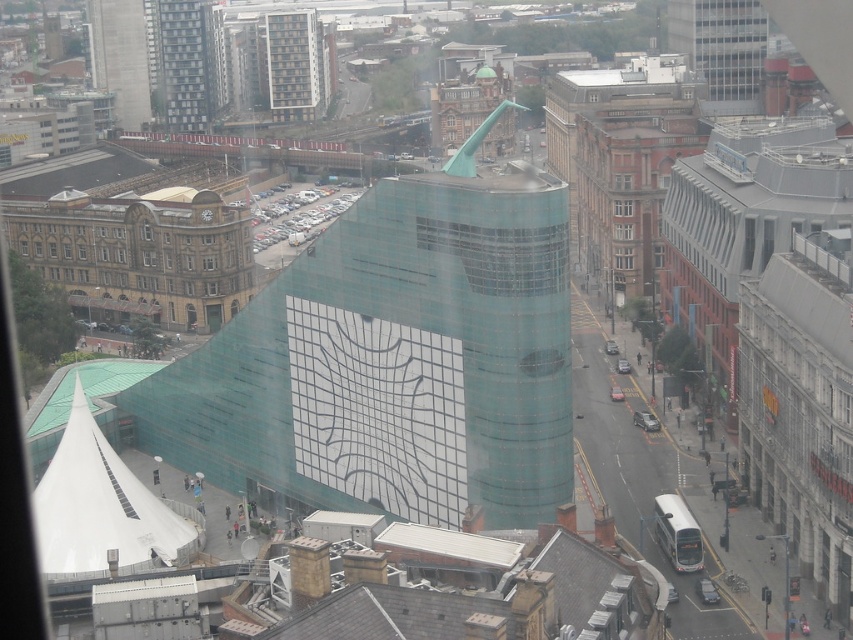
Question: Considering the relative positions of glassy teal building at upper left and transparent glass window at upper center in the image provided, where is glassy teal building at upper left located with respect to transparent glass window at upper center?

Choices:
 (A) below
 (B) above

Answer: (A)

Question: Among these objects, which one is nearest to the camera?

Choices:
 (A) transparent glass window at upper center
 (B) glassy teal building at upper left

Answer: (B)

Question: Is glassy teal building at upper left wider than transparent glass window at upper center?

Choices:
 (A) yes
 (B) no

Answer: (A)

Question: Is glassy teal building at upper left below transparent glass window at upper center?

Choices:
 (A) no
 (B) yes

Answer: (B)